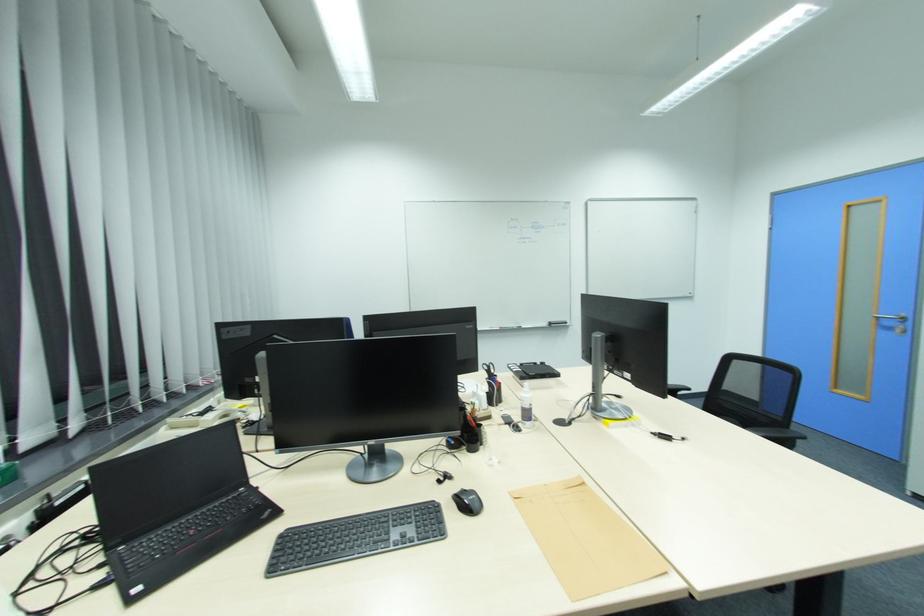
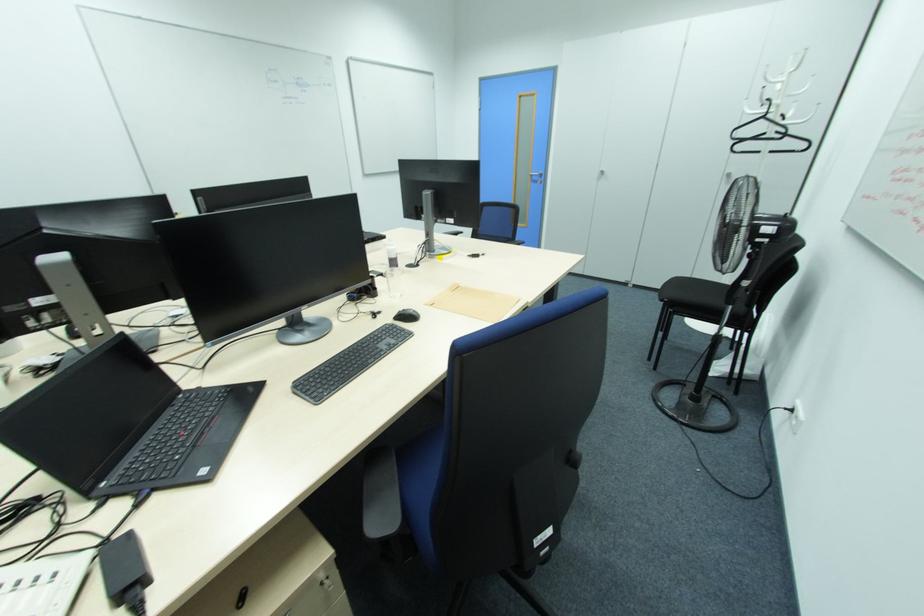
The images are taken continuously from a first-person perspective. In which direction is your viewpoint rotating?

The camera rotated toward right-down.